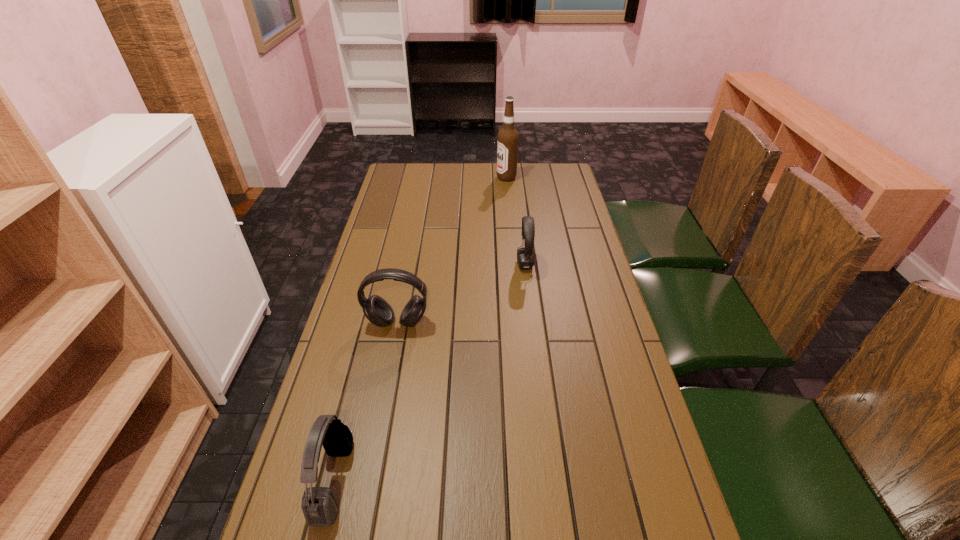
The image size is (960, 540). What are the coordinates of `vacant region located on the front-facing side of the rightmost headset` in the screenshot? It's located at (459, 265).

Locate an element on the screen. Image resolution: width=960 pixels, height=540 pixels. vacant space located on the front-facing side of the rightmost headset is located at coordinates (441, 265).

Find the location of a particular element. The width and height of the screenshot is (960, 540). free space located on the front-facing side of the rightmost headset is located at coordinates (477, 265).

Identify the location of vacant space located 0.160m on the headband of the nearest headset. (423, 481).

Locate an element on the screen. This screenshot has width=960, height=540. object present at the far edge is located at coordinates (507, 141).

In the image, there is a desktop. At what (x,y) coordinates should I click in order to perform the action: click on free space at the far edge. Please return your answer as a coordinate pair (x, y). This screenshot has height=540, width=960. Looking at the image, I should click on (476, 169).

Identify the location of vacant space at the left edge of the desktop. (392, 194).

Where is `vacant space at the right edge of the desktop`? The height and width of the screenshot is (540, 960). vacant space at the right edge of the desktop is located at coordinates (575, 191).

The image size is (960, 540). I want to click on vacant space at the far left corner of the desktop, so click(401, 165).

I want to click on vacant area that lies between the second nearest object and the alcohol, so click(x=452, y=250).